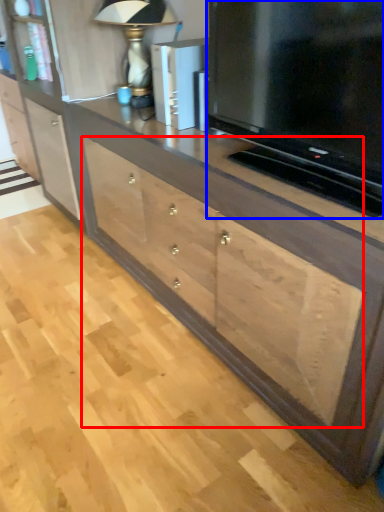
Question: Which object appears closest to the camera in this image, drawer (highlighted by a red box) or television (highlighted by a blue box)?

Choices:
 (A) drawer
 (B) television

Answer: (B)